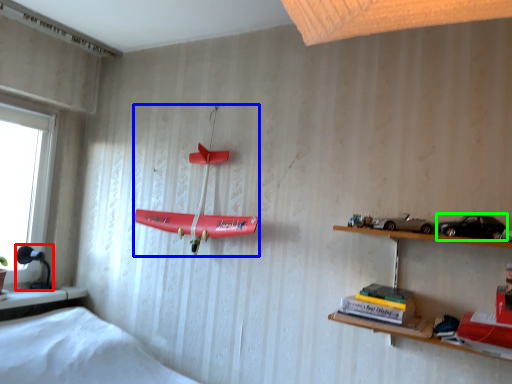
Question: Which object is the closest to the lamp (highlighted by a red box)? Choose among these: toy (highlighted by a blue box) or toy car (highlighted by a green box).

Choices:
 (A) toy
 (B) toy car

Answer: (A)